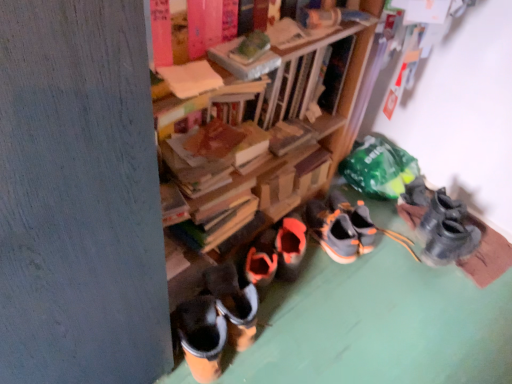
Measure the distance between matte gray sneakers at right, which is the first footwear from right to left, and camera.

They are 1.54 meters apart.

Describe the element at coordinates (379, 324) in the screenshot. The height and width of the screenshot is (384, 512). I see `orange rubber boots at lower left` at that location.

In order to face matte cardboard book at upper center, placed as the 2th book when sorted from back to front, should I rotate leftwards or rightwards?

Turn left by 8.495 degrees to look at matte cardboard book at upper center, placed as the 2th book when sorted from back to front.

What is the approximate height of wooden book at center, marked as the first book in a back-to-front arrangement?

It is 3.27 inches.

What are the coordinates of `matte gray sneakers at right, which is the first footwear from right to left` in the screenshot? It's located at (441, 225).

From a real-world perspective, which is physically below, gray suede sneakers at center, which is counted as the 3th footwear, starting from the right, or matte cardboard book at upper center, placed as the 2th book when sorted from back to front?

In real-world perspective, gray suede sneakers at center, which is counted as the 3th footwear, starting from the right, is lower.

Who is shorter, gray suede sneakers at center, which is counted as the 3th footwear, starting from the right, or matte cardboard book at upper center, positioned as the first book in front-to-back order?

With less height is matte cardboard book at upper center, positioned as the first book in front-to-back order.

Is gray suede sneakers at center, which is counted as the 3th footwear, starting from the right, thinner than matte cardboard book at upper center, placed as the 2th book when sorted from back to front?

No.

Is gray suede sneakers at center, which is the 1th footwear from left to right, closer to the viewer compared to matte cardboard book at upper center, placed as the 2th book when sorted from back to front?

No, gray suede sneakers at center, which is the 1th footwear from left to right, is further to the viewer.

Can you confirm if gray suede sneakers at center, which is counted as the 3th footwear, starting from the right, is positioned to the left of orange suede sneakers at center, positioned as the second footwear in right-to-left order?

Correct, you'll find gray suede sneakers at center, which is counted as the 3th footwear, starting from the right, to the left of orange suede sneakers at center, positioned as the second footwear in right-to-left order.

Can you confirm if gray suede sneakers at center, which is counted as the 3th footwear, starting from the right, is shorter than orange suede sneakers at center, the second footwear positioned from the left?

In fact, gray suede sneakers at center, which is counted as the 3th footwear, starting from the right, may be taller than orange suede sneakers at center, the second footwear positioned from the left.

Is gray suede sneakers at center, which is the 1th footwear from left to right, looking in the opposite direction of orange suede sneakers at center, the second footwear positioned from the left?

No, gray suede sneakers at center, which is the 1th footwear from left to right, is not facing away from orange suede sneakers at center, the second footwear positioned from the left.

Is matte gray sneakers at right, which is the first footwear from right to left, situated inside orange suede sneakers at center, the second footwear positioned from the left, or outside?

The correct answer is: outside.

Relative to orange suede sneakers at center, the second footwear positioned from the left, is matte gray sneakers at right, which is the first footwear from right to left, in front or behind?

Clearly, matte gray sneakers at right, which is the first footwear from right to left, is behind orange suede sneakers at center, the second footwear positioned from the left.

Does point (446, 197) appear closer or farther from the camera than point (364, 230)?

Point (446, 197) is farther from the camera than point (364, 230).

From the image's perspective, between matte gray sneakers at right, which is the first footwear from right to left, and orange suede sneakers at center, positioned as the second footwear in right-to-left order, who is located below?

From the image's view, orange suede sneakers at center, positioned as the second footwear in right-to-left order, is below.

Looking at the image, does orange rubber boots at lower left seem bigger or smaller compared to wooden book at center, placed as the 2th book when sorted from front to back?

In the image, orange rubber boots at lower left appears to be larger than wooden book at center, placed as the 2th book when sorted from front to back.

Is orange rubber boots at lower left inside the boundaries of wooden book at center, placed as the 2th book when sorted from front to back, or outside?

orange rubber boots at lower left is located beyond the bounds of wooden book at center, placed as the 2th book when sorted from front to back.

Based on the photo, is orange rubber boots at lower left facing towards wooden book at center, placed as the 2th book when sorted from front to back?

No, orange rubber boots at lower left is not oriented towards wooden book at center, placed as the 2th book when sorted from front to back.

Based on the photo, who is more distant, matte gray sneakers at right, which is the first footwear from right to left, or gray suede sneakers at center, which is counted as the 3th footwear, starting from the right?

matte gray sneakers at right, which is the first footwear from right to left, is further from the camera.

From a real-world perspective, between matte gray sneakers at right, which is the first footwear from right to left, and gray suede sneakers at center, which is counted as the 3th footwear, starting from the right, who is vertically higher?

In real-world perspective, matte gray sneakers at right, which is the first footwear from right to left, is above.

Which point is more distant from viewer, (434,259) or (310,214)?

Positioned behind is point (310,214).

Considering the relative sizes of matte gray sneakers at right, which is the first footwear from right to left, and matte cardboard book at upper center, placed as the 2th book when sorted from back to front, in the image provided, is matte gray sneakers at right, which is the first footwear from right to left, bigger than matte cardboard book at upper center, placed as the 2th book when sorted from back to front,?

Yes, matte gray sneakers at right, which is the first footwear from right to left, is bigger than matte cardboard book at upper center, placed as the 2th book when sorted from back to front.

Measure the distance between matte gray sneakers at right, acting as the third footwear starting from the left, and matte cardboard book at upper center, placed as the 2th book when sorted from back to front.

The distance of matte gray sneakers at right, acting as the third footwear starting from the left, from matte cardboard book at upper center, placed as the 2th book when sorted from back to front, is 1.12 meters.

At what (x,y) coordinates should I click in order to perform the action: click on the 2nd book to the left of the matte gray sneakers at right, which is the first footwear from right to left, starting your count from the anchor. Please return your answer as a coordinate pair (x, y). Looking at the image, I should click on (190, 78).

Between point (464, 313) and point (461, 225), which one is positioned in front?

The point (464, 313) is closer.

Considering the relative positions of orange rubber boots at lower left and matte gray sneakers at right, acting as the third footwear starting from the left, in the image provided, is orange rubber boots at lower left to the left of matte gray sneakers at right, acting as the third footwear starting from the left, from the viewer's perspective?

Yes.

In terms of size, does orange rubber boots at lower left appear bigger or smaller than matte gray sneakers at right, acting as the third footwear starting from the left?

orange rubber boots at lower left is bigger than matte gray sneakers at right, acting as the third footwear starting from the left.

Is orange rubber boots at lower left oriented away from matte gray sneakers at right, which is the first footwear from right to left?

orange rubber boots at lower left does not have its back to matte gray sneakers at right, which is the first footwear from right to left.

Locate an element on the screen. The image size is (512, 384). book that is the 2nd object located above the gray suede sneakers at center, which is counted as the 3th footwear, starting from the right (from the image's perspective) is located at coordinates (190, 78).

I want to click on footwear in front of the orange suede sneakers at center, positioned as the second footwear in right-to-left order, so click(x=333, y=231).

From the image, which object appears to be nearer to matte gray sneakers at right, which is the first footwear from right to left, orange rubber boots at lower left or orange suede sneakers at center, the second footwear positioned from the left?

Based on the image, orange suede sneakers at center, the second footwear positioned from the left, appears to be nearer to matte gray sneakers at right, which is the first footwear from right to left.

In the scene shown: Which object lies further to the anchor point wooden book at center, marked as the first book in a back-to-front arrangement, matte cardboard book at upper center, placed as the 2th book when sorted from back to front, or matte gray sneakers at right, which is the first footwear from right to left?

Based on the image, matte gray sneakers at right, which is the first footwear from right to left, appears to be further to wooden book at center, marked as the first book in a back-to-front arrangement.

Considering their positions, is matte cardboard book at upper center, positioned as the first book in front-to-back order, positioned further to wooden book at center, placed as the 2th book when sorted from front to back, than orange rubber boots at lower left?

orange rubber boots at lower left lies further to wooden book at center, placed as the 2th book when sorted from front to back, than the other object.

Which object lies further to the anchor point matte gray sneakers at right, acting as the third footwear starting from the left, gray suede sneakers at center, which is the 1th footwear from left to right, or matte cardboard book at upper center, positioned as the first book in front-to-back order?

The object further to matte gray sneakers at right, acting as the third footwear starting from the left, is matte cardboard book at upper center, positioned as the first book in front-to-back order.

Looking at the image, which one is located further to matte gray sneakers at right, which is the first footwear from right to left, orange suede sneakers at center, positioned as the second footwear in right-to-left order, or orange rubber boots at lower left?

orange rubber boots at lower left lies further to matte gray sneakers at right, which is the first footwear from right to left, than the other object.

Based on the photo, considering their positions, is orange suede sneakers at center, the second footwear positioned from the left, positioned further to matte cardboard book at upper center, placed as the 2th book when sorted from back to front, than matte gray sneakers at right, acting as the third footwear starting from the left?

matte gray sneakers at right, acting as the third footwear starting from the left, is further to matte cardboard book at upper center, placed as the 2th book when sorted from back to front.

Which object lies nearer to the anchor point orange suede sneakers at center, the second footwear positioned from the left, orange rubber boots at lower left or matte cardboard book at upper center, positioned as the first book in front-to-back order?

The object closer to orange suede sneakers at center, the second footwear positioned from the left, is orange rubber boots at lower left.

From the image, which object appears to be nearer to orange rubber boots at lower left, gray suede sneakers at center, which is the 1th footwear from left to right, or matte cardboard book at upper center, placed as the 2th book when sorted from back to front?

gray suede sneakers at center, which is the 1th footwear from left to right, is positioned closer to the anchor orange rubber boots at lower left.

This screenshot has height=384, width=512. I want to click on book between matte cardboard book at upper center, positioned as the first book in front-to-back order, and matte gray sneakers at right, which is the first footwear from right to left, in the horizontal direction, so click(x=251, y=148).

You are a GUI agent. You are given a task and a screenshot of the screen. Output one action in this format:
    pyautogui.click(x=<x>, y=<y>)
    Task: Click on the footwear between wooden book at center, placed as the 2th book when sorted from front to back, and orange suede sneakers at center, the second footwear positioned from the left
    
    Given the screenshot: What is the action you would take?
    pyautogui.click(x=333, y=231)

I want to click on book between matte cardboard book at upper center, positioned as the first book in front-to-back order, and orange rubber boots at lower left from top to bottom, so click(x=251, y=148).

The height and width of the screenshot is (384, 512). I want to click on concrete between matte cardboard book at upper center, positioned as the first book in front-to-back order, and gray suede sneakers at center, which is counted as the 3th footwear, starting from the right, in the front-back direction, so click(x=379, y=324).